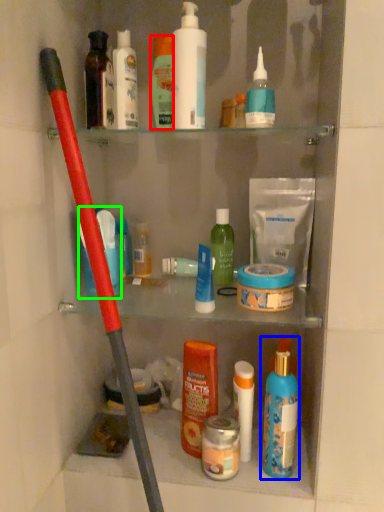
Question: Which is farther away from toiletry (highlighted by a red box)? toiletry (highlighted by a blue box) or toiletry (highlighted by a green box)?

Choices:
 (A) toiletry
 (B) toiletry

Answer: (A)